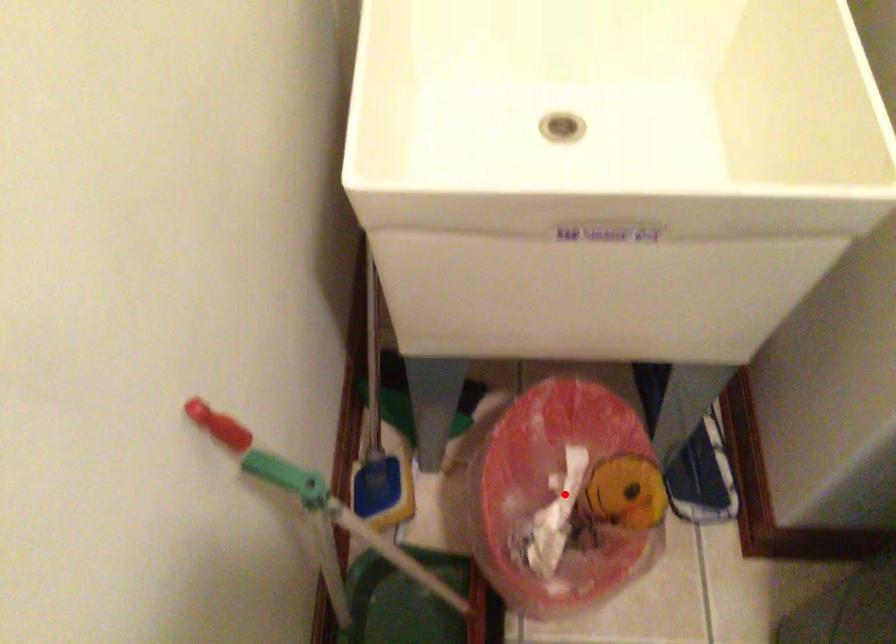
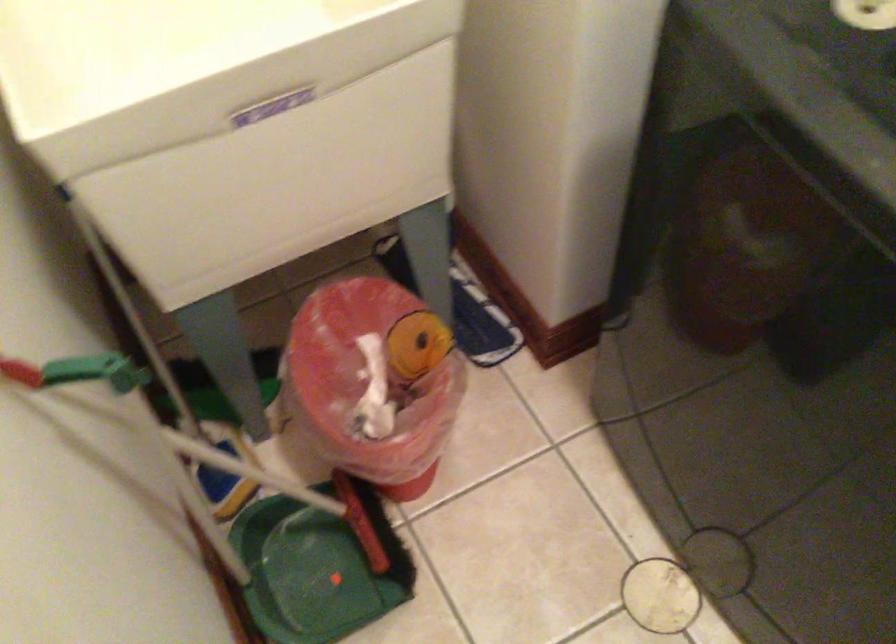
Question: A red point is marked in image1. In image2, is the corresponding 3D point closer to the camera or farther? Reply with the corresponding letter.

Choices:
 (A) The corresponding 3D point is closer.
 (B) The corresponding 3D point is farther.

Answer: (B)